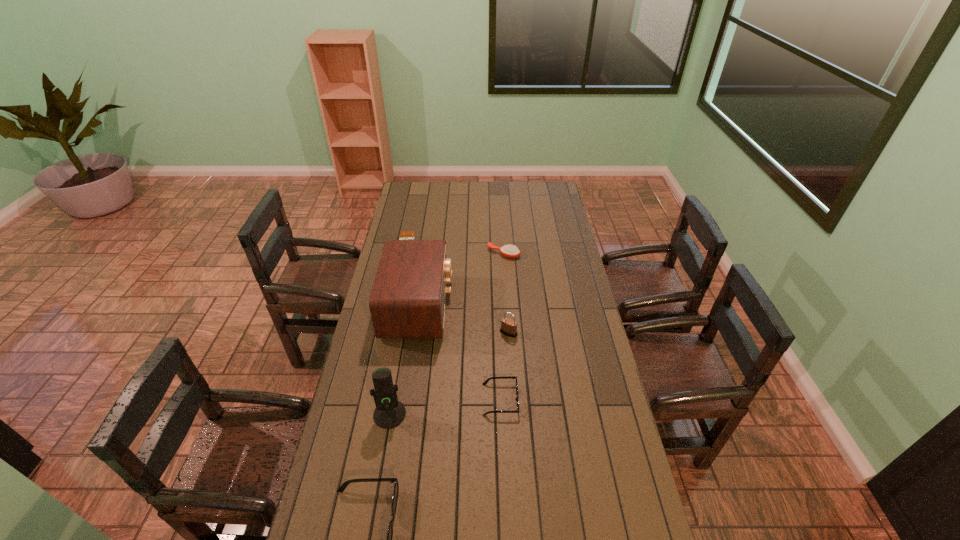
The image size is (960, 540). Identify the location of the farther sunglasses. (507, 377).

Find the location of `the shorter sunglasses`. the shorter sunglasses is located at coordinates (507, 377).

Where is `the shortest object`? The image size is (960, 540). the shortest object is located at coordinates (410, 235).

You are a GUI agent. You are given a task and a screenshot of the screen. Output one action in this format:
    pyautogui.click(x=<x>, y=<y>)
    Task: Click on the microphone
    Image resolution: width=960 pixels, height=540 pixels.
    Given the screenshot: What is the action you would take?
    pyautogui.click(x=389, y=413)

Identify the location of hairbrush. The image size is (960, 540). (511, 251).

Locate an element on the screen. radio receiver is located at coordinates click(407, 300).

Locate an element on the screen. The width and height of the screenshot is (960, 540). padlock is located at coordinates (508, 327).

I want to click on free space located 0.070m on the front-facing side of the farther sunglasses, so coord(539,400).

Where is `free location located 0.060m on the back of the shortest object`? The height and width of the screenshot is (540, 960). free location located 0.060m on the back of the shortest object is located at coordinates (411, 225).

Locate an element on the screen. vacant space located 0.050m on the right of the microphone is located at coordinates (420, 414).